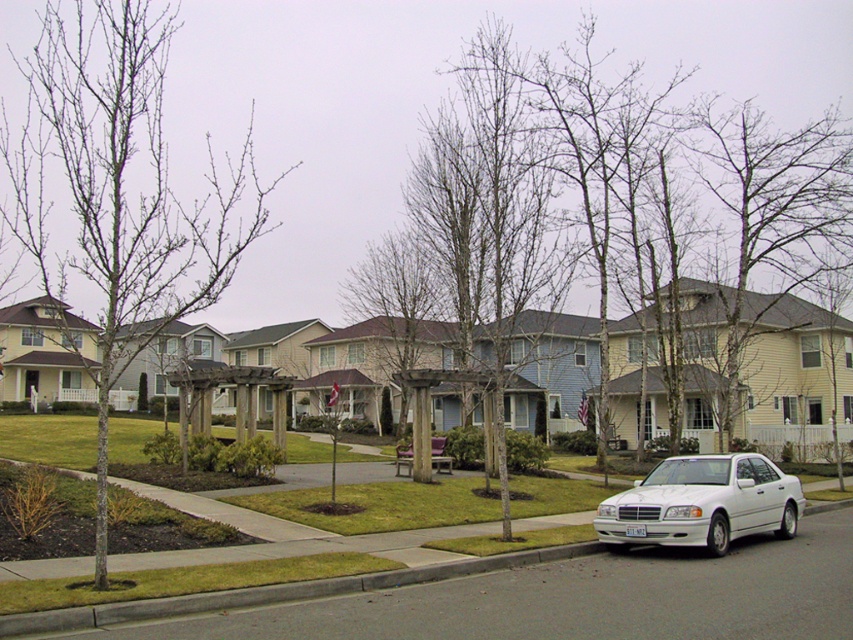
You are a gardener assessing the suburban neighborhood scene. You notice two bare wood trees in the yard. Which tree would require a taller ladder to prune its branches, the bare wood tree at center or the bare wood tree at left?

The bare wood tree at left is taller than the bare wood tree at center, so you would need a taller ladder to prune its branches.

You are standing at the entrance of the house closest to the bare wood tree at center. If you walk straight towards the tree, will you first encounter the wooden pergola or the white sedan parked on the right side?

The wooden pergola is closer to the house entrance than the white sedan parked on the right side, so you would first encounter the wooden pergola.